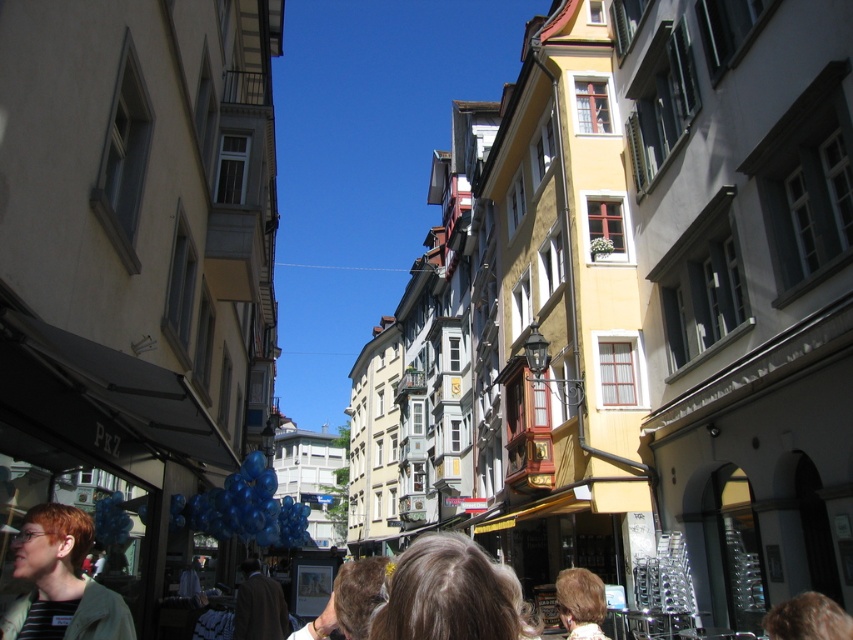
You are standing on the street and want to walk towards the point at coordinates point (437,577). However, there is an obstacle located at point (575,586). Will you be able to reach your destination without going around the obstacle?

Yes, because point (437,577) is in front of point (575,586), so you can reach it without needing to go around the obstacle.

You are a photographer standing in the middle of the street. You notice two people with light brown hair at center and light brown hair at lower center. Which person has hair that is narrower?

The light brown hair at center has a lesser width compared to light brown hair at lower center, so the person with light brown hair at center has narrower hair.